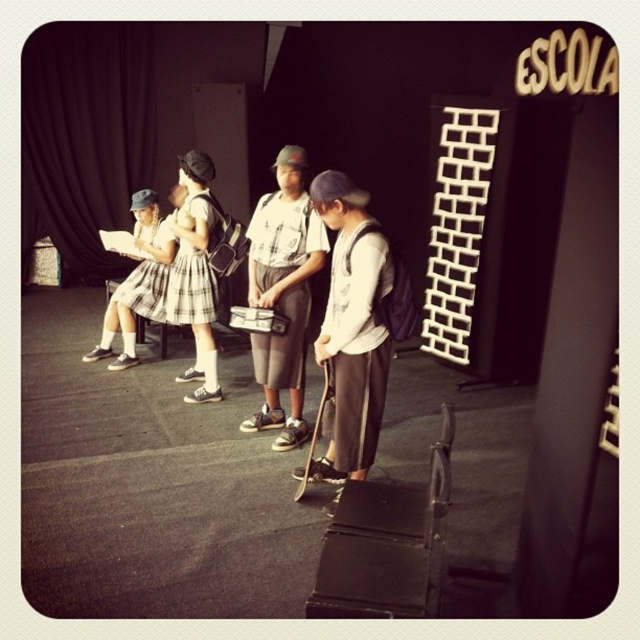
Which of these two, white matte shirt at center or plaid skirt at left, stands shorter?

With less height is plaid skirt at left.

Measure the distance from white matte shirt at center to plaid skirt at left.

white matte shirt at center and plaid skirt at left are 6.83 feet apart.

Find the location of a particular element. The width and height of the screenshot is (640, 640). white matte shirt at center is located at coordinates (352, 330).

The width and height of the screenshot is (640, 640). I want to click on white matte shirt at center, so click(352, 330).

Does matte white shirt at center appear on the right side of plaid skirt at left?

Indeed, matte white shirt at center is positioned on the right side of plaid skirt at left.

Between matte white shirt at center and plaid skirt at left, which one is positioned lower?

matte white shirt at center is lower down.

Does point (262, 337) lie in front of point (173, 248)?

Yes, it is in front of point (173, 248).

Locate an element on the screen. matte white shirt at center is located at coordinates (284, 292).

Is white matte shirt at center below matte white shirt at center?

Yes.

Does white matte shirt at center appear on the left side of matte white shirt at center?

In fact, white matte shirt at center is to the right of matte white shirt at center.

Is point (360, 298) farther from viewer compared to point (280, 244)?

No, (360, 298) is closer to viewer.

You are a GUI agent. You are given a task and a screenshot of the screen. Output one action in this format:
    pyautogui.click(x=<x>, y=<y>)
    Task: Click on the white matte shirt at center
    
    Given the screenshot: What is the action you would take?
    pyautogui.click(x=352, y=330)